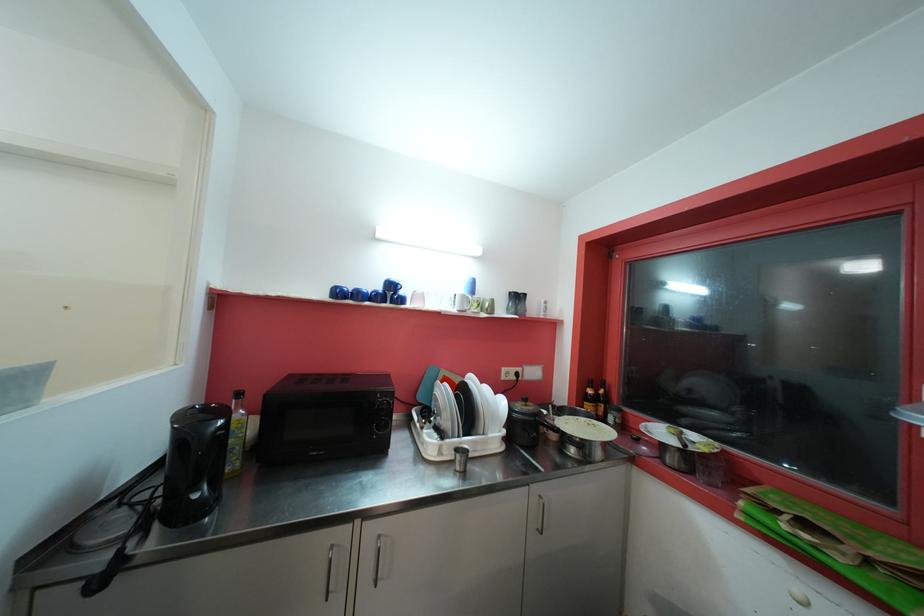
Locate an element on the screen. This screenshot has height=616, width=924. clear oil bottle is located at coordinates (236, 436).